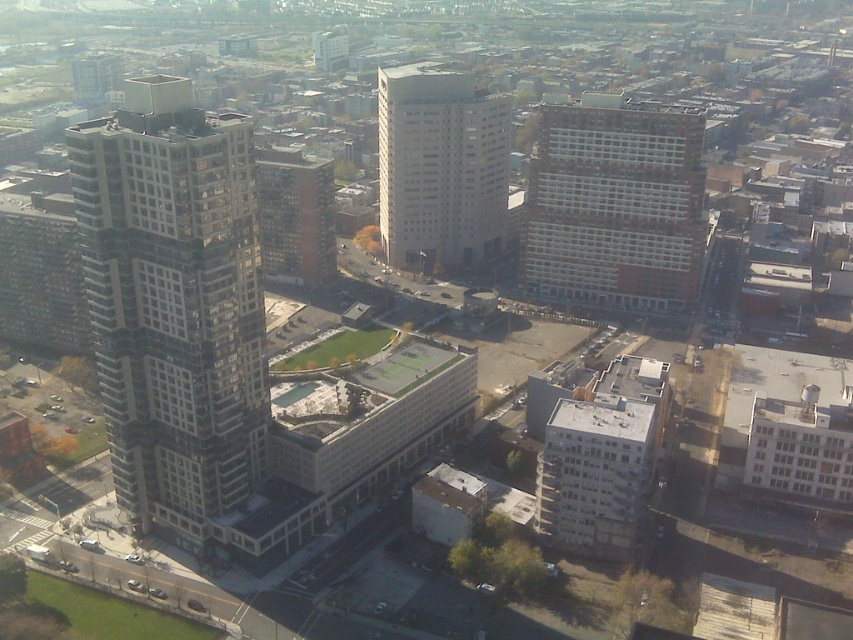
Is point (106, 426) farther from viewer compared to point (325, 216)?

No, (106, 426) is in front of (325, 216).

This screenshot has width=853, height=640. What are the coordinates of `glassy gray skyscraper at left` in the screenshot? It's located at (173, 304).

Is point (184, 202) behind point (604, 136)?

That is False.

Between point (128, 163) and point (633, 275), which one is positioned behind?

Positioned behind is point (633, 275).

Where is `glassy gray skyscraper at left`? The height and width of the screenshot is (640, 853). glassy gray skyscraper at left is located at coordinates (173, 304).

Between white brick building at center and white glass building at center, which one is positioned higher?

Positioned higher is white glass building at center.

Can you confirm if white brick building at center is bigger than white glass building at center?

No, white brick building at center is not bigger than white glass building at center.

Between point (581, 99) and point (438, 113), which one is positioned behind?

Positioned behind is point (438, 113).

Identify the location of white brick building at center. This screenshot has height=640, width=853. (614, 205).